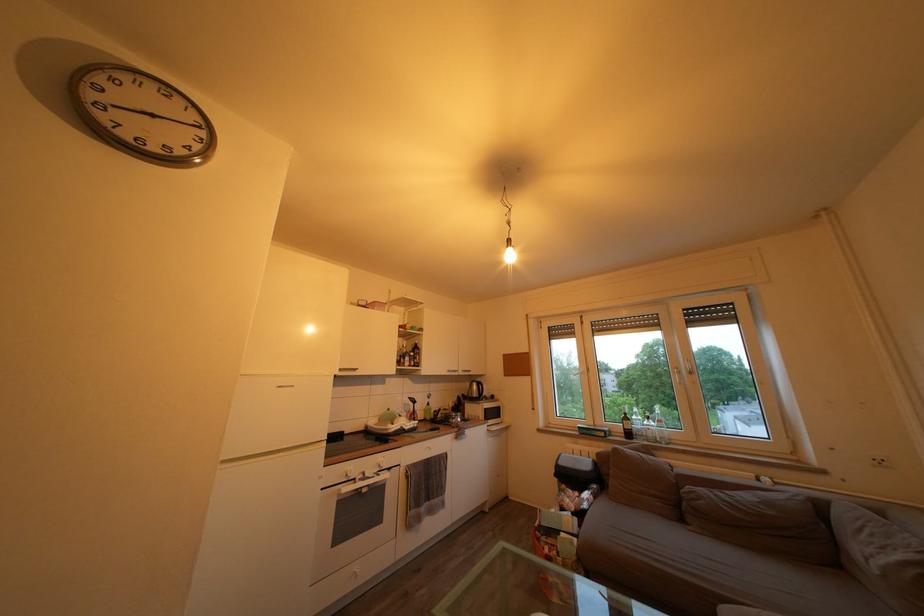
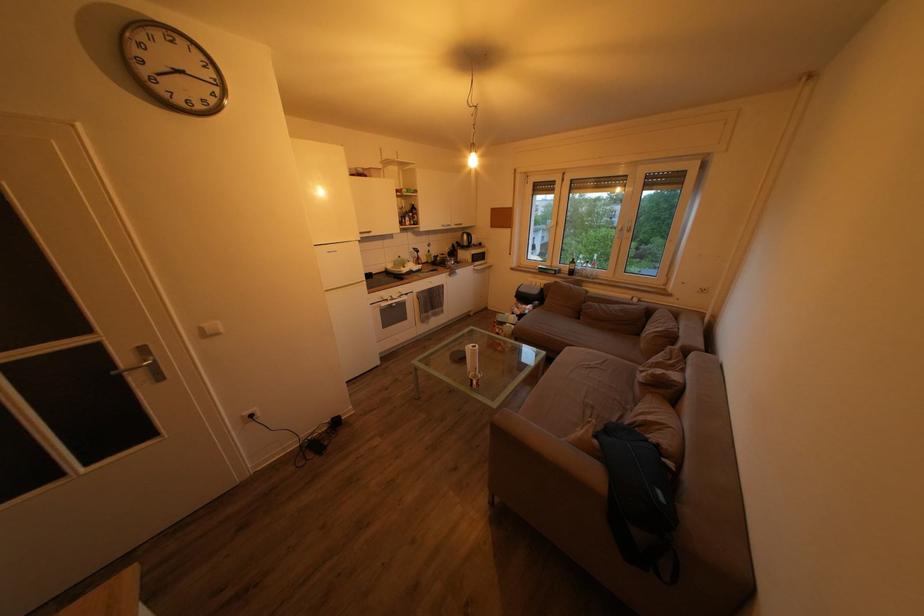
Question: The first image is from the beginning of the video and the second image is from the end. How did the camera likely rotate when shooting the video?

Choices:
 (A) Left
 (B) Right
 (C) Up
 (D) Down

Answer: (D)